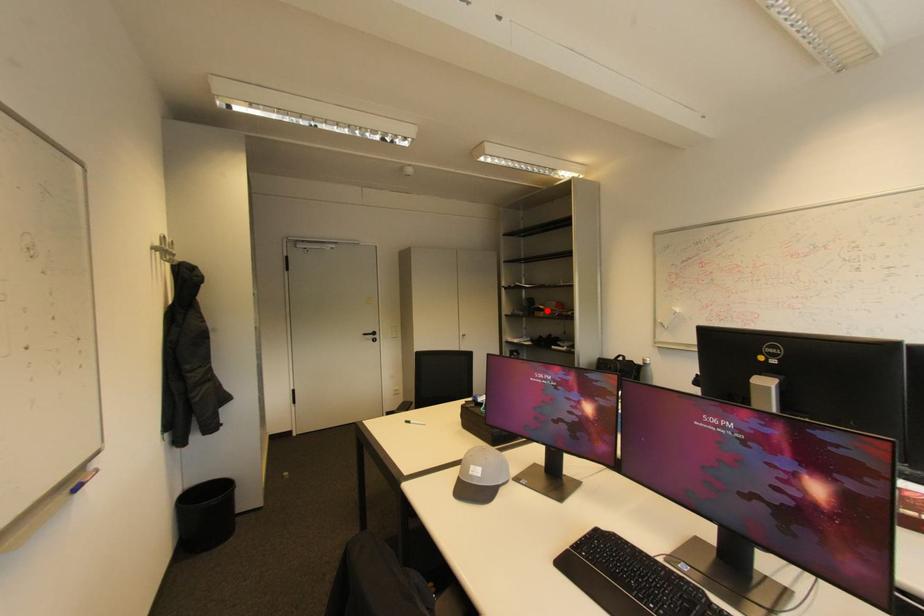
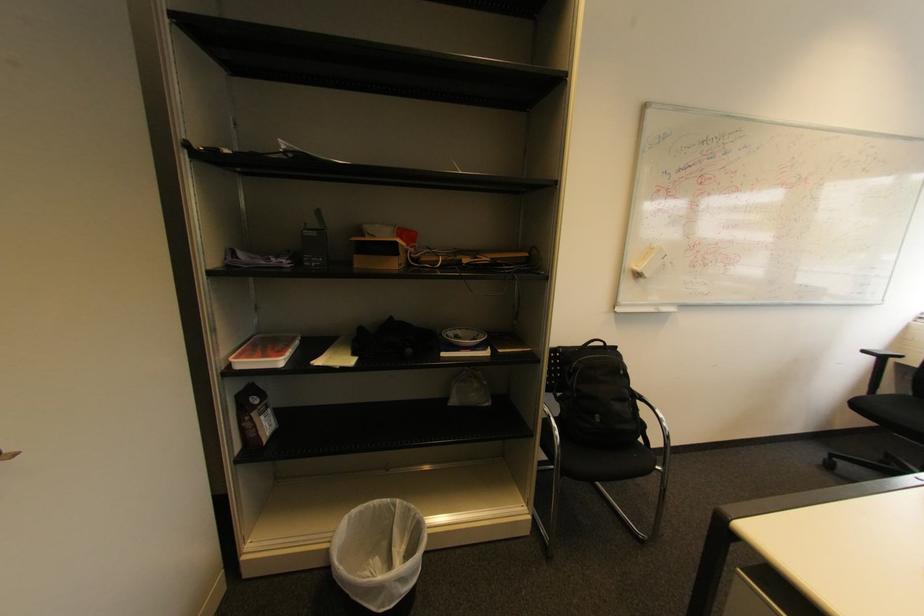
In the second image, find the point that corresponds to the highlighted location in the first image.

(395, 251)